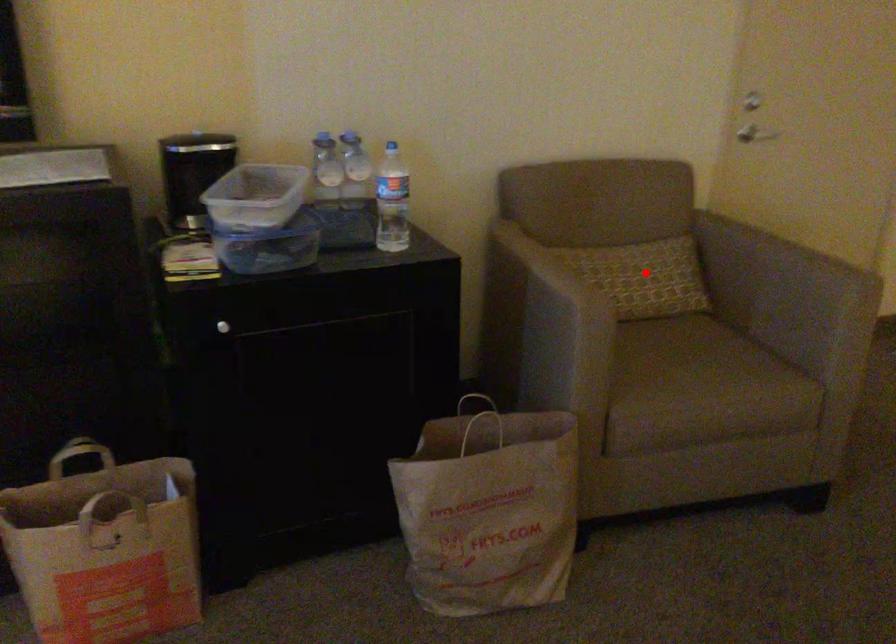
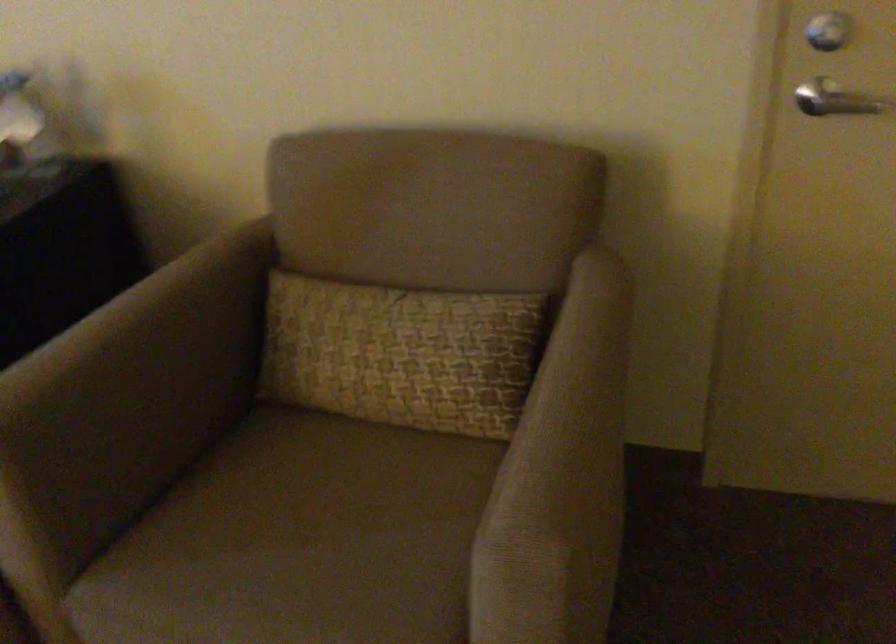
Find the pixel in the second image that matches the highlighted location in the first image.

(401, 353)